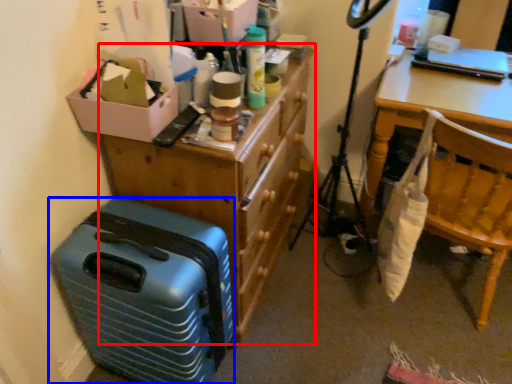
Question: Which of the following is the closest to the observer, dresser (highlighted by a red box) or suitcase (highlighted by a blue box)?

Choices:
 (A) dresser
 (B) suitcase

Answer: (B)